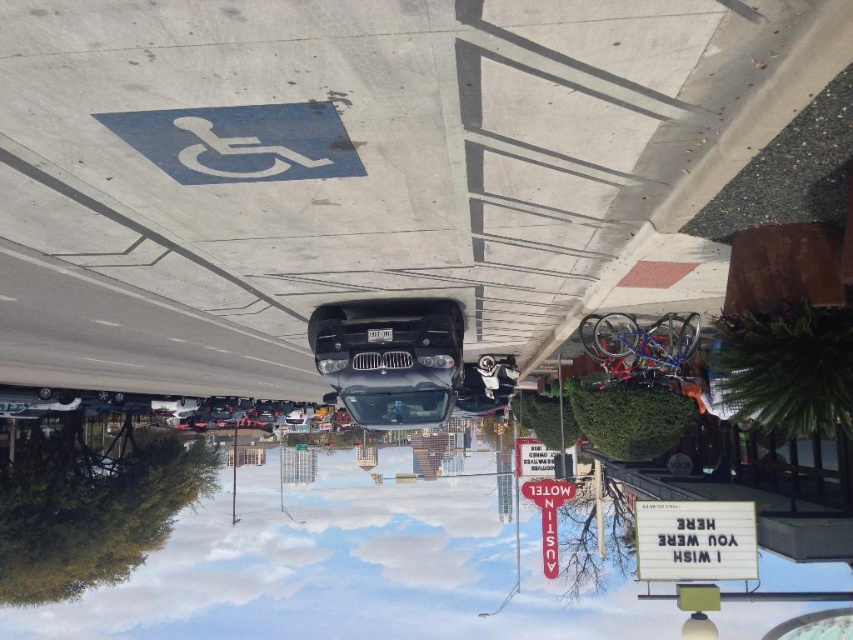
You are a delivery person trying to park a van that is 16 feet long in this parking lot. The van needs to be parked so that it doesn not block the white plastic sign at center. Based on the scene description, can the sleek black car at center be moved to a position where the van can fit without blocking the sign?

The sleek black car at center is currently 15.06 feet away from the white plastic sign at center. Since the van is 16 feet long, it would require at least 16 feet of space to park without blocking the sign. The current distance between the car and the sign is insufficient, so the van cannot fit without overlapping the sign. Therefore, the sleek black car at center must be moved to create enough space.